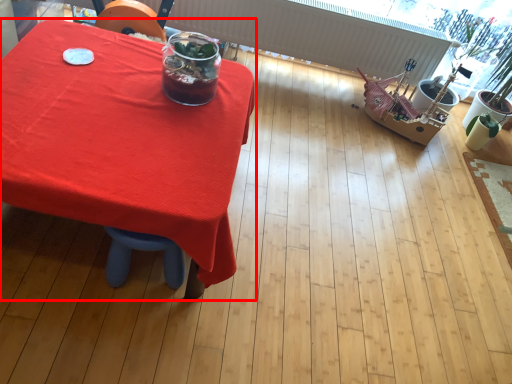
Question: In this image, where is table (annotated by the red box) located relative to drink?

Choices:
 (A) right
 (B) left

Answer: (B)